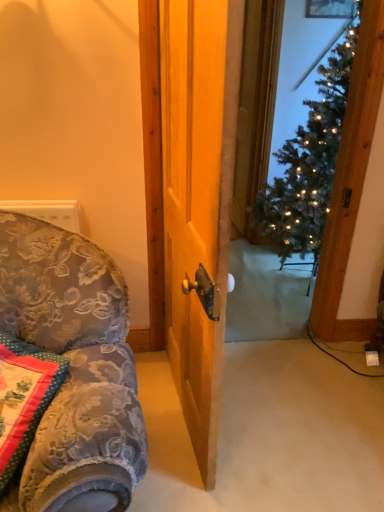
Question: In terms of width, does iridescent metallic christmas tree at center look wider or thinner when compared to floral fabric pillow at lower left?

Choices:
 (A) wide
 (B) thin

Answer: (A)

Question: Considering the positions of iridescent metallic christmas tree at center and floral fabric pillow at lower left in the image, is iridescent metallic christmas tree at center bigger or smaller than floral fabric pillow at lower left?

Choices:
 (A) big
 (B) small

Answer: (A)

Question: In terms of height, does iridescent metallic christmas tree at center look taller or shorter compared to floral fabric pillow at lower left?

Choices:
 (A) short
 (B) tall

Answer: (B)

Question: Looking at the image, does floral fabric pillow at lower left seem bigger or smaller compared to iridescent metallic christmas tree at center?

Choices:
 (A) big
 (B) small

Answer: (B)

Question: Considering their positions, is floral fabric pillow at lower left located in front of or behind iridescent metallic christmas tree at center?

Choices:
 (A) behind
 (B) front

Answer: (B)

Question: From their relative heights in the image, would you say floral fabric pillow at lower left is taller or shorter than iridescent metallic christmas tree at center?

Choices:
 (A) short
 (B) tall

Answer: (A)

Question: Is floral fabric pillow at lower left situated inside iridescent metallic christmas tree at center or outside?

Choices:
 (A) inside
 (B) outside

Answer: (B)